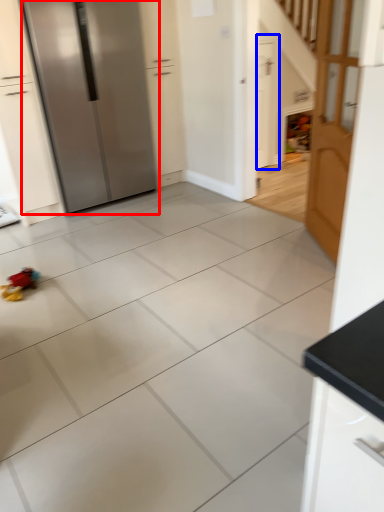
Question: Which point is closer to the camera, refrigerator (highlighted by a red box) or door (highlighted by a blue box)?

Choices:
 (A) refrigerator
 (B) door

Answer: (A)